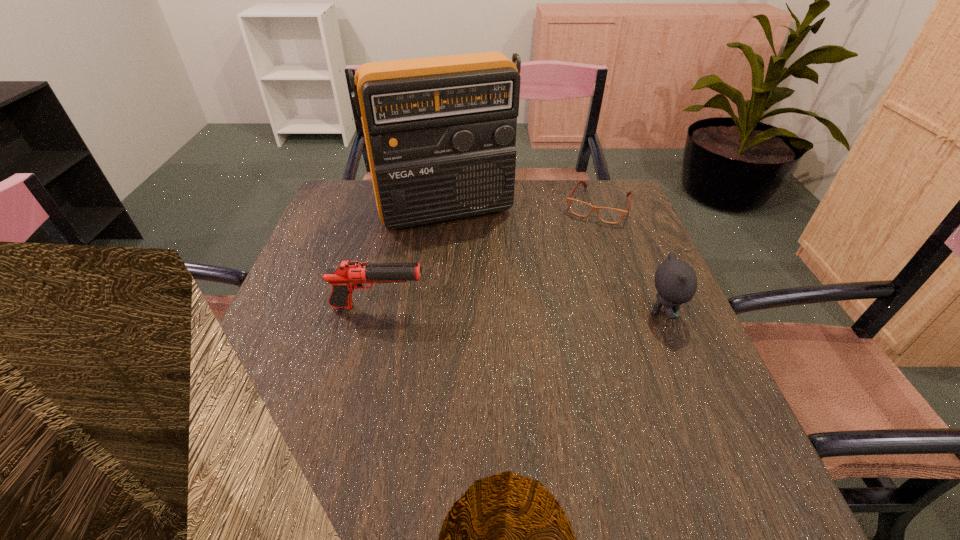
This screenshot has width=960, height=540. In order to click on vacant space at the left edge of the desktop in this screenshot , I will do `click(285, 360)`.

Find the location of `free space at the right edge`. free space at the right edge is located at coordinates (624, 333).

In the image, there is a desktop. Find the location of `vacant space at the far right corner`. vacant space at the far right corner is located at coordinates (588, 199).

Where is `blank region between the kitten and the gun`? This screenshot has height=540, width=960. blank region between the kitten and the gun is located at coordinates (520, 310).

Where is `vacant space that's between the tallest object and the kitten`? The height and width of the screenshot is (540, 960). vacant space that's between the tallest object and the kitten is located at coordinates (555, 262).

Locate an element on the screen. Image resolution: width=960 pixels, height=540 pixels. unoccupied position between the gun and the kitten is located at coordinates (520, 310).

Locate an element on the screen. free space between the kitten and the radio receiver is located at coordinates (555, 262).

Where is `empty space that is in between the kitten and the shortest object`? empty space that is in between the kitten and the shortest object is located at coordinates (631, 259).

In order to click on vacant point located between the kitten and the gun in this screenshot , I will do click(520, 310).

At what (x,y) coordinates should I click in order to perform the action: click on unoccupied position between the gun and the radio receiver. Please return your answer as a coordinate pair (x, y). This screenshot has height=540, width=960. Looking at the image, I should click on (412, 259).